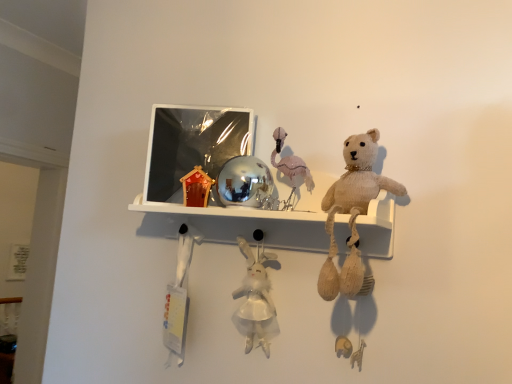
Describe the element at coordinates (255, 294) in the screenshot. I see `white plush rabbit at center, marked as the second toy in a right-to-left arrangement` at that location.

Image resolution: width=512 pixels, height=384 pixels. What do you see at coordinates (192, 145) in the screenshot?
I see `metallic reflective picture frame at upper center` at bounding box center [192, 145].

This screenshot has width=512, height=384. Find the location of `metallic reflective picture frame at upper center`. metallic reflective picture frame at upper center is located at coordinates (192, 145).

This screenshot has height=384, width=512. What do you see at coordinates (352, 211) in the screenshot?
I see `knitted beige teddy bear at upper right` at bounding box center [352, 211].

What is the approximate height of shiny metallic ball at center?

It is 5.18 centimeters.

Image resolution: width=512 pixels, height=384 pixels. What are the coordinates of `white plush rabbit at center, which is the second toy in left-to-right order` in the screenshot? It's located at (255, 294).

Does white fabric toy at lower left, the third toy in the right-to-left sequence, turn towards white plush rabbit at center, which is the second toy in left-to-right order?

No, white fabric toy at lower left, the third toy in the right-to-left sequence, is not facing towards white plush rabbit at center, which is the second toy in left-to-right order.

Is white fabric toy at lower left, the third toy in the right-to-left sequence, at the left side of white plush rabbit at center, marked as the second toy in a right-to-left arrangement?

Indeed, white fabric toy at lower left, the third toy in the right-to-left sequence, is positioned on the left side of white plush rabbit at center, marked as the second toy in a right-to-left arrangement.

Identify the location of toy that is the 1st one above the white fabric toy at lower left, the third toy in the right-to-left sequence (from a real-world perspective). The image size is (512, 384). (255, 294).

Based on the photo, from a real-world perspective, who is located higher, white fabric toy at lower left, which is the 1th toy in left-to-right order, or white plush rabbit at center, which is the second toy in left-to-right order?

white plush rabbit at center, which is the second toy in left-to-right order.

Do you think white fabric toy at lower left, which is the 1th toy in left-to-right order, is within shiny metallic ball at center, or outside of it?

white fabric toy at lower left, which is the 1th toy in left-to-right order, exists outside the volume of shiny metallic ball at center.

Looking at this image, is white fabric toy at lower left, the third toy in the right-to-left sequence, wider or thinner than shiny metallic ball at center?

Clearly, white fabric toy at lower left, the third toy in the right-to-left sequence, has less width compared to shiny metallic ball at center.

Is white fabric toy at lower left, which is the 1th toy in left-to-right order, in contact with shiny metallic ball at center?

No, white fabric toy at lower left, which is the 1th toy in left-to-right order, is not in contact with shiny metallic ball at center.

Based on their sizes in the image, would you say white fabric toy at lower left, the third toy in the right-to-left sequence, is bigger or smaller than shiny metallic ball at center?

Clearly, white fabric toy at lower left, the third toy in the right-to-left sequence, is smaller in size than shiny metallic ball at center.

Is metallic reflective picture frame at upper center oriented towards shiny metallic ball at center?

No, metallic reflective picture frame at upper center is not oriented towards shiny metallic ball at center.

From a real-world perspective, relative to shiny metallic ball at center, is metallic reflective picture frame at upper center vertically above or below?

metallic reflective picture frame at upper center is above shiny metallic ball at center.

From the image's perspective, who appears lower, metallic reflective picture frame at upper center or shiny metallic ball at center?

From the image's view, shiny metallic ball at center is below.

Considering the sizes of objects metallic reflective picture frame at upper center and shiny metallic ball at center in the image provided, who is shorter, metallic reflective picture frame at upper center or shiny metallic ball at center?

With less height is shiny metallic ball at center.

Does shiny metallic ball at center come in front of white plush rabbit at center, marked as the second toy in a right-to-left arrangement?

Yes.

Choose the correct answer: Is shiny metallic ball at center inside white plush rabbit at center, marked as the second toy in a right-to-left arrangement, or outside it?

shiny metallic ball at center is outside white plush rabbit at center, marked as the second toy in a right-to-left arrangement.

The width and height of the screenshot is (512, 384). What are the coordinates of `shelf on the left of the white plush rabbit at center, which is the second toy in left-to-right order` in the screenshot? It's located at [x=237, y=224].

Looking at this image, is shiny metallic ball at center bigger or smaller than white plush rabbit at center, marked as the second toy in a right-to-left arrangement?

In the image, shiny metallic ball at center appears to be larger than white plush rabbit at center, marked as the second toy in a right-to-left arrangement.

Identify the location of teddy bear that appears below the metallic reflective picture frame at upper center (from the image's perspective). This screenshot has width=512, height=384. (352, 211).

Which of these two, knitted beige teddy bear at upper right or metallic reflective picture frame at upper center, stands shorter?

metallic reflective picture frame at upper center.

Could you tell me if knitted beige teddy bear at upper right is turned towards metallic reflective picture frame at upper center?

No.

Is knitted beige teddy bear at upper right directly adjacent to metallic reflective picture frame at upper center?

No, knitted beige teddy bear at upper right is not with metallic reflective picture frame at upper center.

Could you tell me if shiny metallic ball at center is turned towards metallic reflective picture frame at upper center?

No, shiny metallic ball at center does not turn towards metallic reflective picture frame at upper center.

Choose the correct answer: Is shiny metallic ball at center inside metallic reflective picture frame at upper center or outside it?

shiny metallic ball at center lies outside metallic reflective picture frame at upper center.

Does shiny metallic ball at center appear on the left side of metallic reflective picture frame at upper center?

No.

How much distance is there between pink fabric flamingo at center, acting as the third toy starting from the left, and metallic reflective picture frame at upper center?

They are 7.46 inches apart.

Does pink fabric flamingo at center, which is the 1th toy from right to left, appear on the right side of metallic reflective picture frame at upper center?

Indeed, pink fabric flamingo at center, which is the 1th toy from right to left, is positioned on the right side of metallic reflective picture frame at upper center.

Can you confirm if pink fabric flamingo at center, acting as the third toy starting from the left, is taller than metallic reflective picture frame at upper center?

No, pink fabric flamingo at center, acting as the third toy starting from the left, is not taller than metallic reflective picture frame at upper center.

Where is `toy directly beneath the white plush rabbit at center, marked as the second toy in a right-to-left arrangement (from a real-world perspective)`? toy directly beneath the white plush rabbit at center, marked as the second toy in a right-to-left arrangement (from a real-world perspective) is located at coordinates (178, 298).

Locate an element on the screen. The width and height of the screenshot is (512, 384). shelf to the right of white fabric toy at lower left, the third toy in the right-to-left sequence is located at coordinates (237, 224).

Looking at the image, which one is located further to metallic reflective picture frame at upper center, shiny metallic ball at center or knitted beige teddy bear at upper right?

knitted beige teddy bear at upper right is further to metallic reflective picture frame at upper center.

Estimate the real-world distances between objects in this image. Which object is further from white fabric toy at lower left, which is the 1th toy in left-to-right order, knitted beige teddy bear at upper right or metallic reflective picture frame at upper center?

knitted beige teddy bear at upper right.

Estimate the real-world distances between objects in this image. Which object is further from pink fabric flamingo at center, acting as the third toy starting from the left, metallic reflective picture frame at upper center or shiny metallic ball at center?

metallic reflective picture frame at upper center is further to pink fabric flamingo at center, acting as the third toy starting from the left.

Based on their spatial positions, is knitted beige teddy bear at upper right or white plush rabbit at center, which is the second toy in left-to-right order, closer to white fabric toy at lower left, the third toy in the right-to-left sequence?

white plush rabbit at center, which is the second toy in left-to-right order, is closer to white fabric toy at lower left, the third toy in the right-to-left sequence.

From the image, which object appears to be farther from metallic reflective picture frame at upper center, pink fabric flamingo at center, which is the 1th toy from right to left, or white fabric toy at lower left, which is the 1th toy in left-to-right order?

white fabric toy at lower left, which is the 1th toy in left-to-right order, is further to metallic reflective picture frame at upper center.

Based on their spatial positions, is white plush rabbit at center, which is the second toy in left-to-right order, or shiny metallic ball at center further from pink fabric flamingo at center, acting as the third toy starting from the left?

white plush rabbit at center, which is the second toy in left-to-right order, is positioned further to the anchor pink fabric flamingo at center, acting as the third toy starting from the left.

Estimate the real-world distances between objects in this image. Which object is further from knitted beige teddy bear at upper right, pink fabric flamingo at center, acting as the third toy starting from the left, or metallic reflective picture frame at upper center?

metallic reflective picture frame at upper center is positioned further to the anchor knitted beige teddy bear at upper right.

Looking at the image, which one is located closer to shiny metallic ball at center, pink fabric flamingo at center, which is the 1th toy from right to left, or white fabric toy at lower left, which is the 1th toy in left-to-right order?

pink fabric flamingo at center, which is the 1th toy from right to left, is closer to shiny metallic ball at center.

Locate an element on the screen. shelf between knitted beige teddy bear at upper right and white plush rabbit at center, which is the second toy in left-to-right order, vertically is located at coordinates (237, 224).

This screenshot has width=512, height=384. I want to click on teddy bear between metallic reflective picture frame at upper center and white plush rabbit at center, which is the second toy in left-to-right order, from top to bottom, so click(x=352, y=211).

Identify the location of shelf between pink fabric flamingo at center, acting as the third toy starting from the left, and white plush rabbit at center, which is the second toy in left-to-right order, vertically. This screenshot has width=512, height=384. (237, 224).

Find the location of a particular element. The width and height of the screenshot is (512, 384). picture frame situated between white fabric toy at lower left, the third toy in the right-to-left sequence, and knitted beige teddy bear at upper right from left to right is located at coordinates (192, 145).